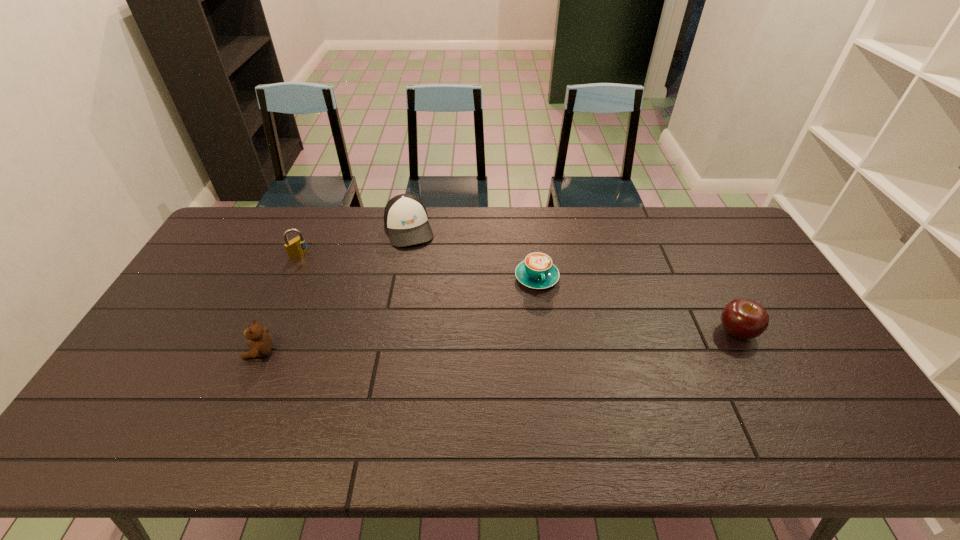
Image resolution: width=960 pixels, height=540 pixels. I want to click on vacant space on the desktop that is between the teddy bear and the apple and is positioned on the side with the combination dials of the padlock, so click(x=462, y=343).

This screenshot has width=960, height=540. I want to click on free space on the desktop that is between the teddy bear and the rightmost object and is positioned with the handle on the right side of the second object from right to left, so click(x=560, y=339).

Where is `free space on the desktop that is between the teddy bear and the rightmost object and is positioned on the front panel of the cap`? The image size is (960, 540). free space on the desktop that is between the teddy bear and the rightmost object and is positioned on the front panel of the cap is located at coordinates (448, 344).